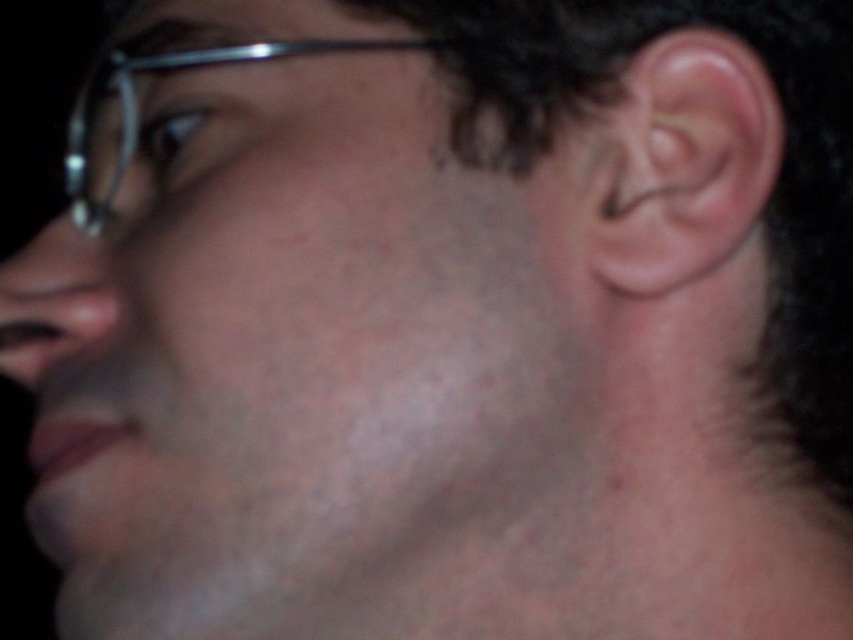
You are an artist trying to sketch this portrait. You want to ensure the proportions are accurate. Which object between the pinkish skin ear at right and the metallic frame glasses at upper left should you draw first to maintain proper scale, considering their sizes?

The pinkish skin ear at right has a lesser width compared to the metallic frame glasses at upper left. Therefore, you should draw the metallic frame glasses at upper left first as they are wider, establishing the scale before detailing the smaller ear.

You are a photographer adjusting the focus on a camera. You need to ensure that both the pinkish skin ear at right and the metallic frame glasses at upper left are in focus. Given that the depth of field can only cover 4 inches, will both objects be in focus?

The distance between the pinkish skin ear at right and metallic frame glasses at upper left is 5.08 inches. Since the depth of field can only cover 4 inches, both objects cannot be in focus simultaneously.

You are a photographer adjusting the focus on your camera. You notice a point at coordinates point [730,115] on the person face. If the minimum focus distance for your lens is 12 inches, will the point be in focus?

The distance of point [730,115] from the camera is 12.35 inches, which is greater than the minimum focus distance of 12 inches. Therefore, the point will be in focus.